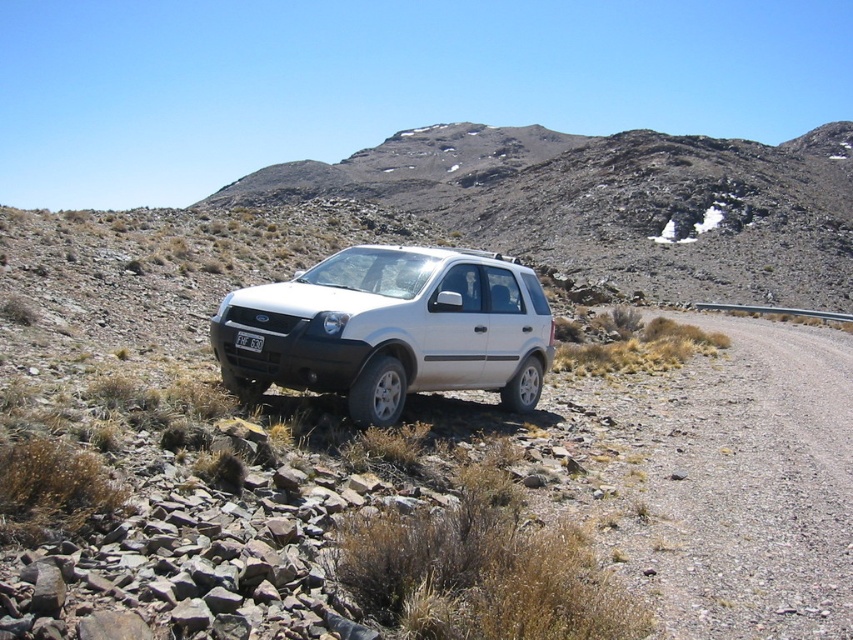
Question: Among these objects, which one is farthest from the camera?

Choices:
 (A) white matte suv at center
 (B) white plastic license plate at center

Answer: (B)

Question: Estimate the real-world distances between objects in this image. Which object is closer to the white plastic license plate at center?

Choices:
 (A) white matte suv at center
 (B) gray gravel road at right

Answer: (A)

Question: Does white matte suv at center have a smaller size compared to white plastic license plate at center?

Choices:
 (A) yes
 (B) no

Answer: (B)

Question: Considering the relative positions of gray gravel road at right and white matte suv at center in the image provided, where is gray gravel road at right located with respect to white matte suv at center?

Choices:
 (A) below
 (B) above

Answer: (A)

Question: Does gray gravel road at right have a lesser width compared to white matte suv at center?

Choices:
 (A) no
 (B) yes

Answer: (A)

Question: Which object appears farthest from the camera in this image?

Choices:
 (A) white plastic license plate at center
 (B) white matte suv at center

Answer: (A)